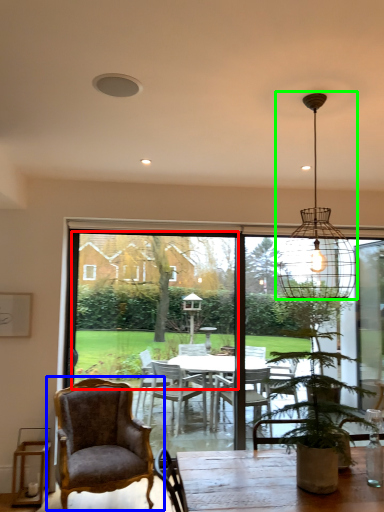
Question: Based on their relative distances, which object is farther from window screen (highlighted by a red box)? Choose from chair (highlighted by a blue box) and light fixture (highlighted by a green box).

Choices:
 (A) chair
 (B) light fixture

Answer: (B)